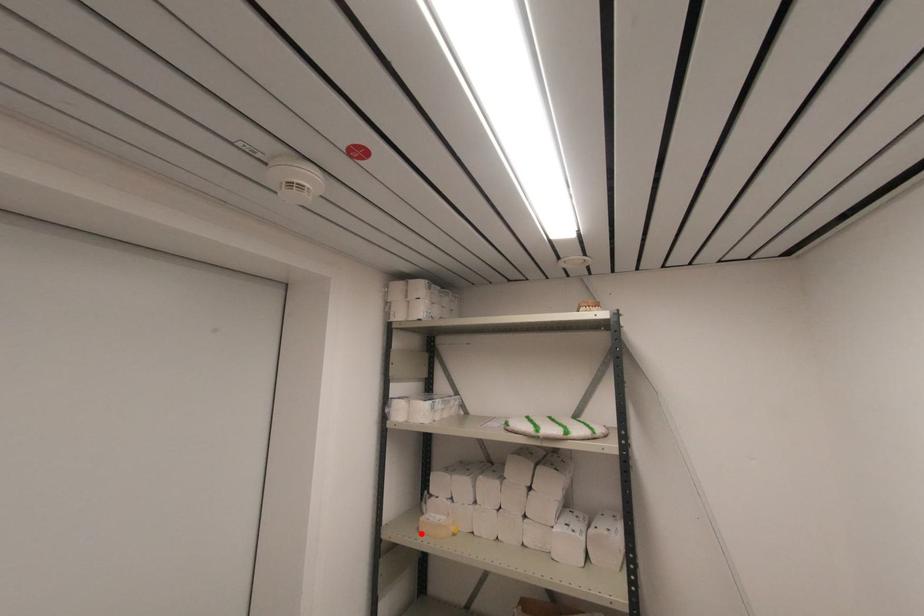
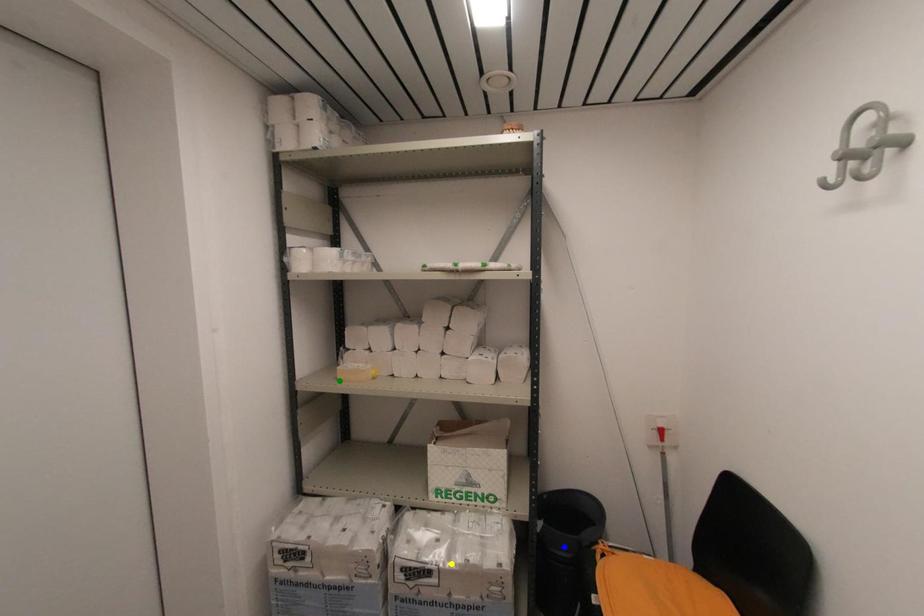
Question: I am providing you with two images of the same scene from different viewpoints. A red point is marked on the first image. You are given multiple points on the second image. Which point in image 2 is actually the same real-world point as the red point in image 1?

Choices:
 (A) yellow point
 (B) blue point
 (C) green point

Answer: (C)